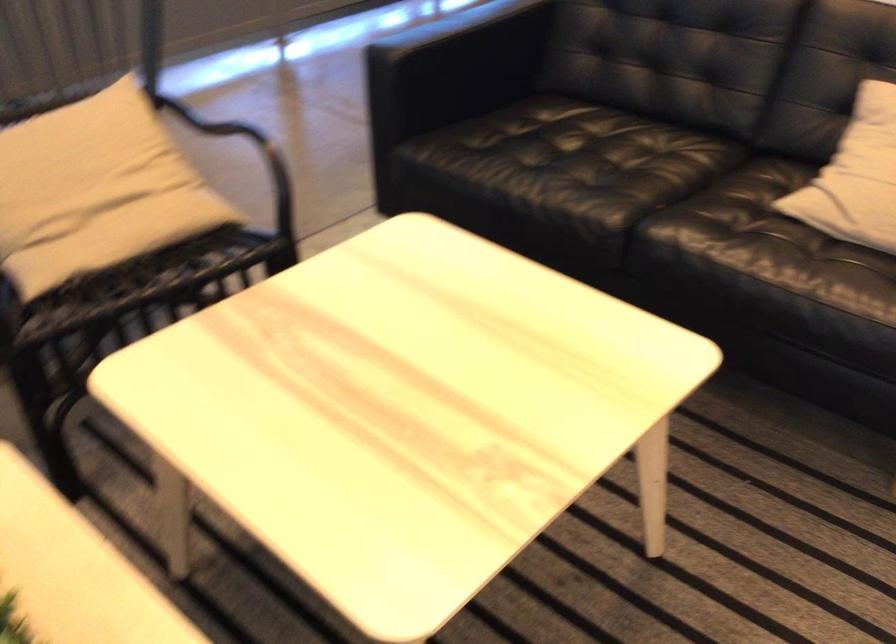
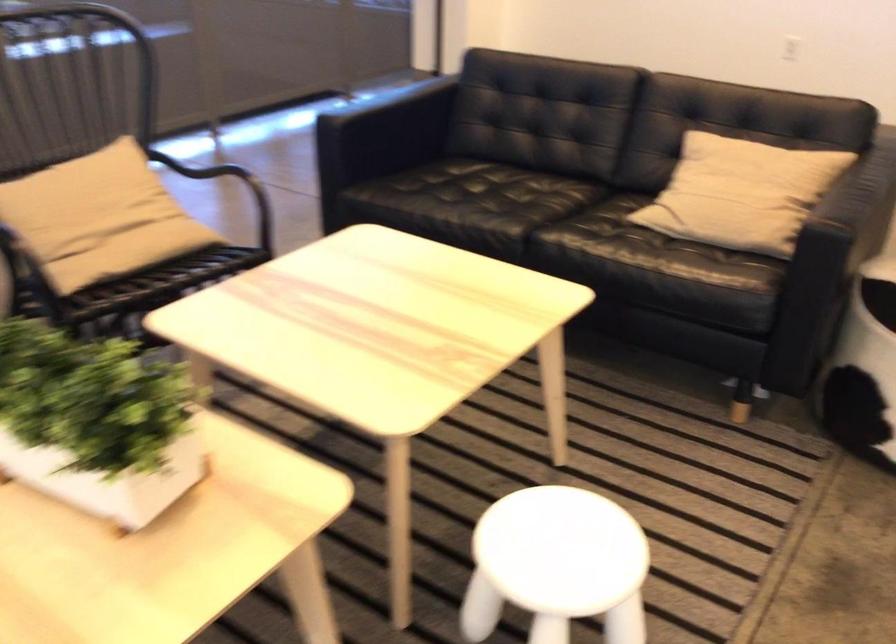
Where in the second image is the point corresponding to point (90, 175) from the first image?

(99, 214)